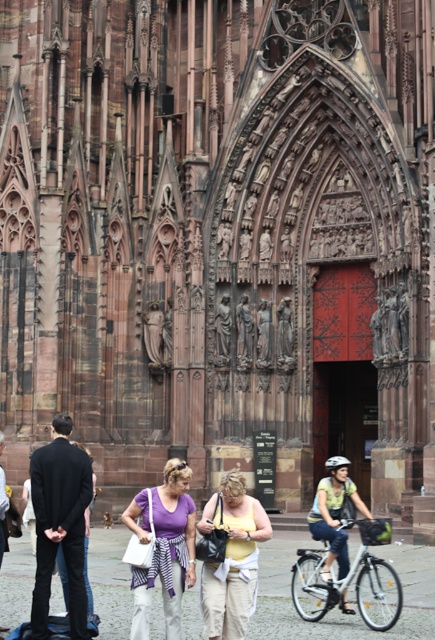
Question: Considering the real-world distances, which object is closest to the purple fabric shirt at center?

Choices:
 (A) yellow cotton shirt at center
 (B) smooth stone statue at center
 (C) black matte suit at left

Answer: (A)

Question: Which point is farther to the camera?

Choices:
 (A) dark gray jacket at lower left
 (B) purple fabric shirt at center
 (C) white matte bicycle at lower center

Answer: (C)

Question: Can you confirm if black matte suit at left is positioned above yellow cotton shirt at center?

Choices:
 (A) no
 (B) yes

Answer: (B)

Question: Does yellow cotton shirt at center appear under dark gray jacket at lower left?

Choices:
 (A) no
 (B) yes

Answer: (B)

Question: From the image, what is the correct spatial relationship of purple fabric shirt at center in relation to yellow cotton shirt at center?

Choices:
 (A) left
 (B) right

Answer: (A)

Question: Which point is farther from the camera taking this photo?

Choices:
 (A) (226, 625)
 (B) (338, 598)

Answer: (B)